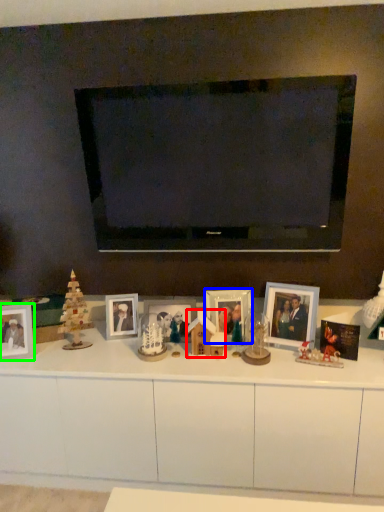
Question: Estimate the real-world distances between objects in this image. Which object is closer to toy (highlighted by a red box), picture frame (highlighted by a blue box) or picture frame (highlighted by a green box)?

Choices:
 (A) picture frame
 (B) picture frame

Answer: (A)